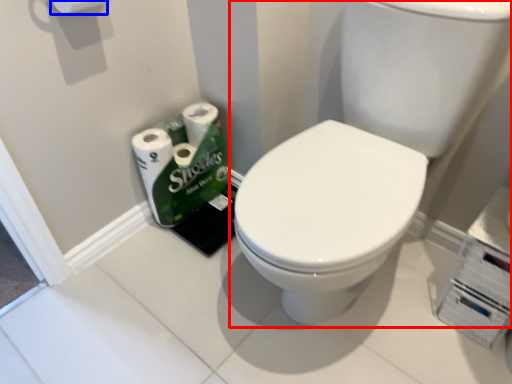
Question: Which of the following is the closest to the observer, sink (highlighted by a red box) or toilet paper (highlighted by a blue box)?

Choices:
 (A) sink
 (B) toilet paper

Answer: (A)